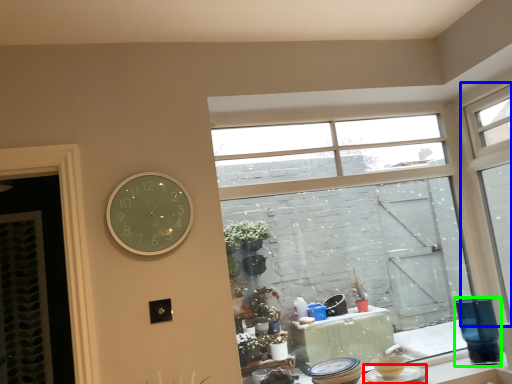
Question: Which object is the closest to the tableware (highlighted by a red box)? Choose among these: window (highlighted by a blue box) or glass vase (highlighted by a green box).

Choices:
 (A) window
 (B) glass vase

Answer: (B)